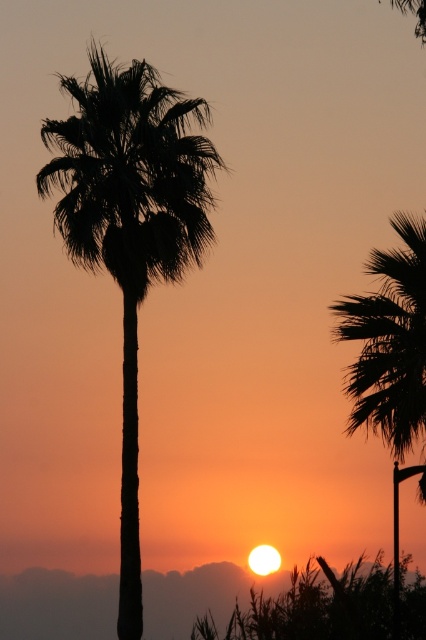
Question: Which object is closer to the camera taking this photo?

Choices:
 (A) silhouette leafy palm at right
 (B) silhouette leafy palm at center

Answer: (A)

Question: Is silhouette leafy palm at center behind silhouette leafy palm at right?

Choices:
 (A) no
 (B) yes

Answer: (B)

Question: Can you confirm if silhouette leafy palm at center is smaller than silhouette leafy palm at right?

Choices:
 (A) no
 (B) yes

Answer: (B)

Question: Is silhouette leafy palm at center thinner than silhouette leafy palm at right?

Choices:
 (A) no
 (B) yes

Answer: (B)

Question: Which point is closer to the camera taking this photo?

Choices:
 (A) (92, 163)
 (B) (368, 353)

Answer: (B)

Question: Which of the following is the farthest from the observer?

Choices:
 (A) (353, 323)
 (B) (141, 186)

Answer: (B)